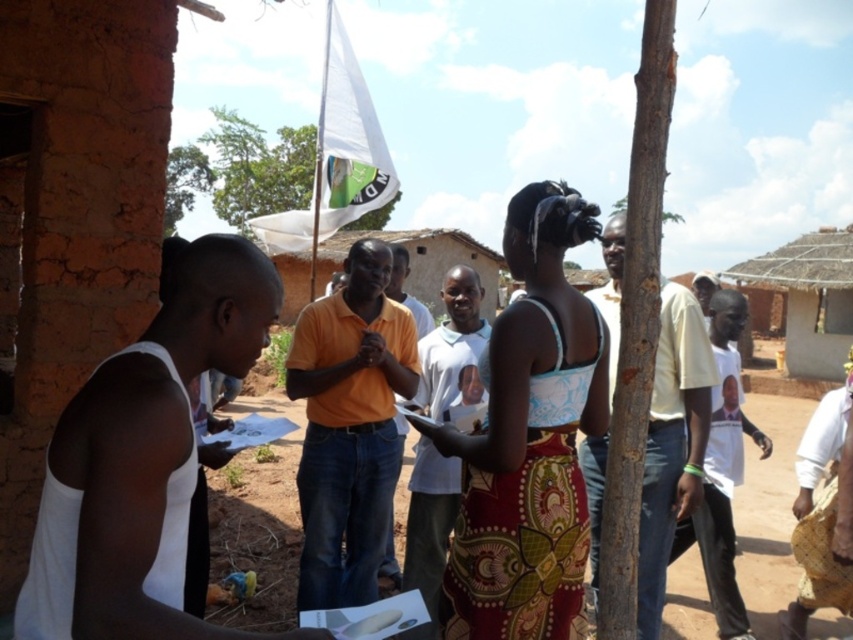
Question: Which object appears farthest from the camera in this image?

Choices:
 (A) white fabric flag at upper center
 (B) printed fabric dress at center

Answer: (A)

Question: Is printed fabric dress at center above white fabric flag at upper center?

Choices:
 (A) yes
 (B) no

Answer: (B)

Question: Does printed fabric dress at center appear on the left side of white fabric flag at upper center?

Choices:
 (A) no
 (B) yes

Answer: (A)

Question: Does printed fabric dress at center appear over white fabric flag at upper center?

Choices:
 (A) yes
 (B) no

Answer: (B)